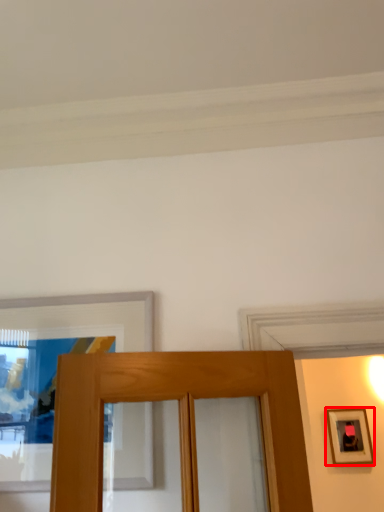
Question: From the image, what is the correct spatial relationship of picture frame (annotated by the red box) in relation to picture frame?

Choices:
 (A) right
 (B) left

Answer: (A)